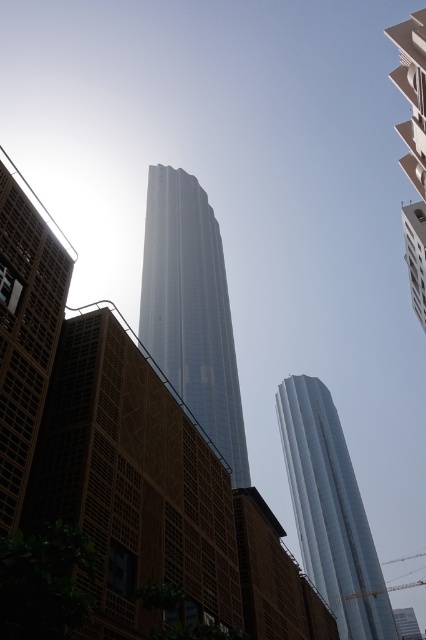
You are an architect analyzing the urban scene. You notice two towers, the shiny glass tower at center and the silver metallic tower at center. Based on their positions, which one is more likely to cast a shadow over the other during midday? Please explain your reasoning.

The shiny glass tower at center is wider than the silver metallic tower at center. Since they are both at the center, the wider tower would cast a larger shadow, potentially covering more area. However, if they are positioned side by side, the wider tower might cast a shadow on the narrower one depending on their exact alignment. Without specific positioning details, it is challenging to determine definitively, but the width difference suggests the shiny glass tower could cast a larger shadow.

In the scene shown: You are an architect analyzing the urban skyline. Given the silver metallic tower at center and the brown textured wall at left, which object would cast a longer shadow during midday? Please base your answer on their relative sizes and positions.

The silver metallic tower at center is larger in size than the brown textured wall at left, so it would cast a longer shadow during midday.

From the picture: You are standing in the urban scene looking up at the skyscrapers. Where is the brown textured wall at left located in terms of coordinates?

The brown textured wall at left is located at coordinates point (25, 328).